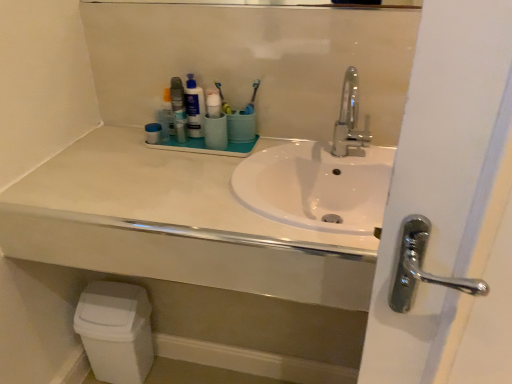
Locate an element on the screen. This screenshot has width=512, height=384. vacant space that is to the left of matte plastic mouthwash at center is located at coordinates (122, 141).